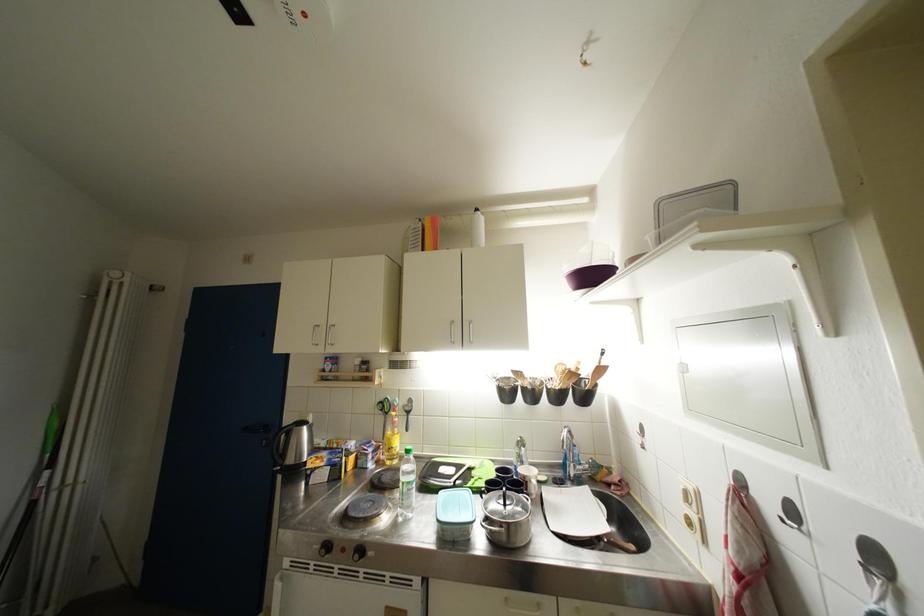
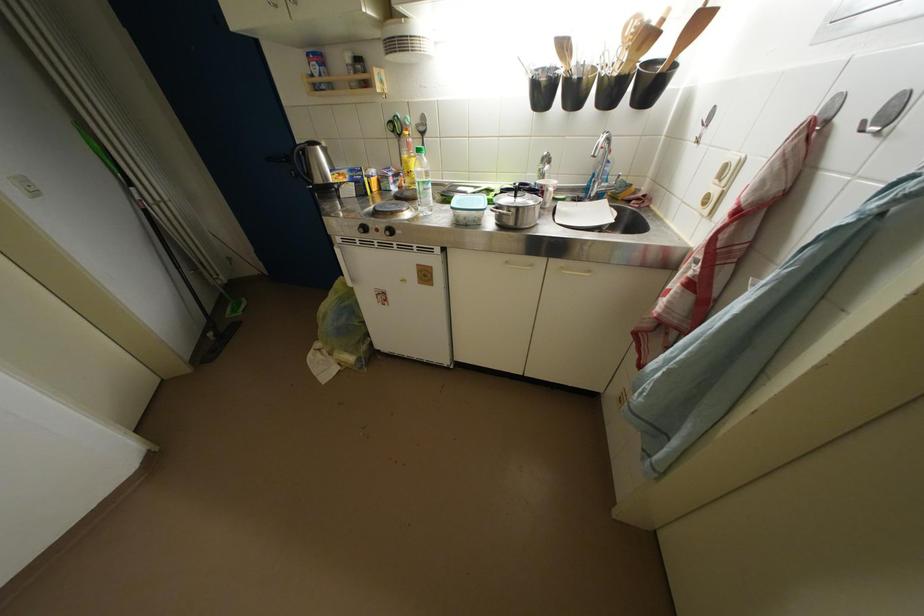
Where in the second image is the point corresponding to (525,446) from the first image?

(551, 161)